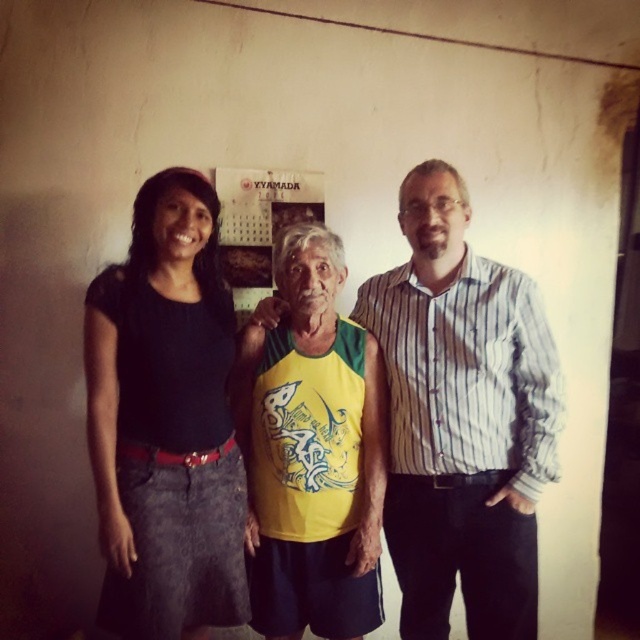
Is point (474, 417) positioned in front of point (305, 413)?

Yes, it is in front of point (305, 413).

Does yellow-green fabric shirt at center have a smaller size compared to yellow-green jersey at center?

Incorrect, yellow-green fabric shirt at center is not smaller in size than yellow-green jersey at center.

Which is behind, point (502, 266) or point (317, 326)?

Point (317, 326)

Locate an element on the screen. Image resolution: width=640 pixels, height=640 pixels. yellow-green fabric shirt at center is located at coordinates click(x=461, y=417).

Does black denim skirt at left have a lesser height compared to yellow-green jersey at center?

Incorrect, black denim skirt at left's height does not fall short of yellow-green jersey at center's.

Between black denim skirt at left and yellow-green jersey at center, which one is positioned higher?

black denim skirt at left is higher up.

You are a GUI agent. You are given a task and a screenshot of the screen. Output one action in this format:
    pyautogui.click(x=<x>, y=<y>)
    Task: Click on the black denim skirt at left
    
    Given the screenshot: What is the action you would take?
    pyautogui.click(x=164, y=420)

Can you confirm if yellow-green fabric shirt at center is thinner than striped cotton shirt at center?

In fact, yellow-green fabric shirt at center might be wider than striped cotton shirt at center.

Locate an element on the screen. This screenshot has height=640, width=640. yellow-green fabric shirt at center is located at coordinates (461, 417).

Who is more forward, (532, 436) or (476, 592)?

Point (532, 436) is in front.

Where is `yellow-green fabric shirt at center`? The height and width of the screenshot is (640, 640). yellow-green fabric shirt at center is located at coordinates (461, 417).